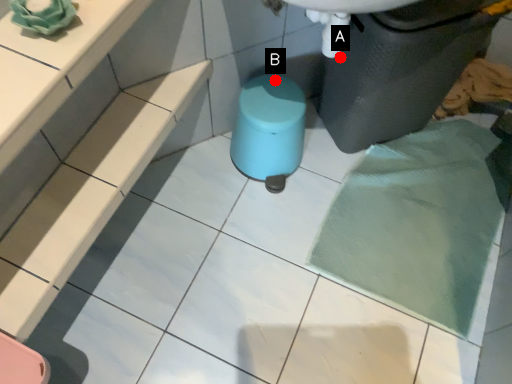
Question: Two points are circled on the image, labeled by A and B beside each circle. Which point is closer to the camera?

Choices:
 (A) A is closer
 (B) B is closer

Answer: (A)